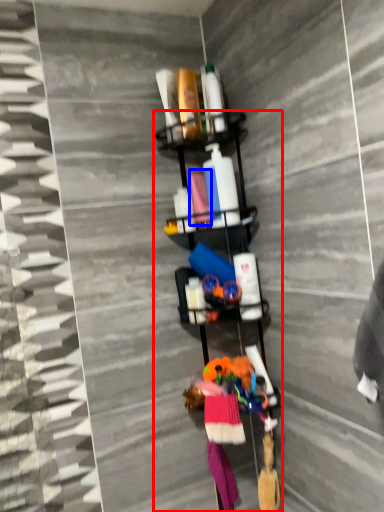
Question: Which point is further to the camera, shelf (highlighted by a red box) or fabric (highlighted by a blue box)?

Choices:
 (A) shelf
 (B) fabric

Answer: (B)